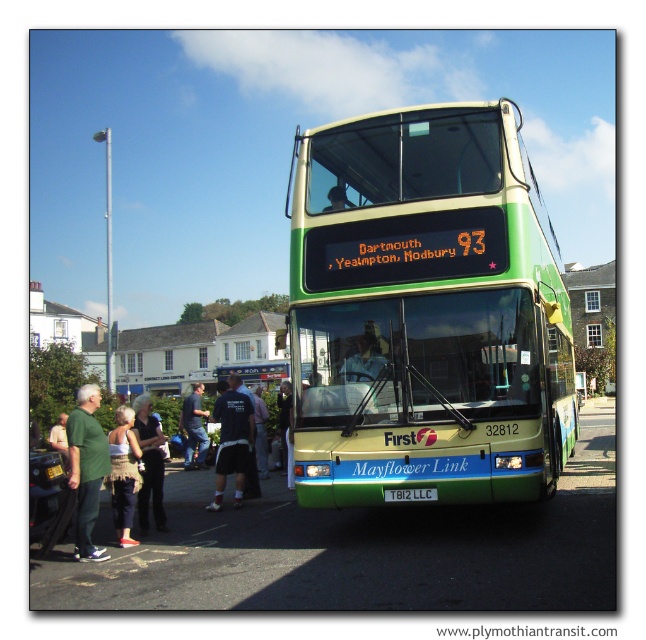
Question: Which object is positioned closest to the green matte/deck bus at center?

Choices:
 (A) dark blue jersey at center
 (B) white plastic license plate at center

Answer: (B)

Question: Does dark blue t-shirt at center lie behind white plastic license plate at center?

Choices:
 (A) no
 (B) yes

Answer: (B)

Question: Which of the following is the farthest from the observer?

Choices:
 (A) dark blue t-shirt at center
 (B) green cotton shirt at lower left

Answer: (A)

Question: Does knitted beige sweater at lower left come behind white plastic license plate at center?

Choices:
 (A) yes
 (B) no

Answer: (A)

Question: Which point appears closest to the camera in this image?

Choices:
 (A) (138, 506)
 (B) (430, 488)

Answer: (B)

Question: Can you confirm if green cotton shirt at lower left is wider than dark blue t-shirt at center?

Choices:
 (A) yes
 (B) no

Answer: (B)